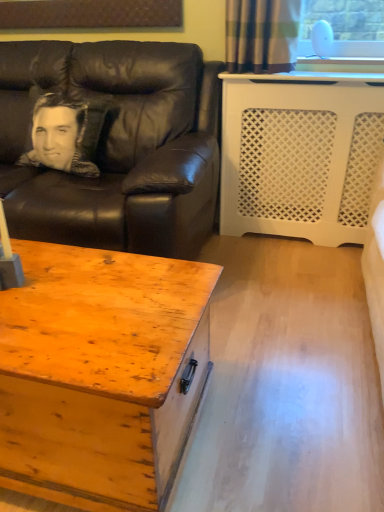
What is the approximate height of black leather couch at left?

37.76 inches.

Identify the location of silky black pillow at left. (59, 135).

Is silky black pillow at left far from black leather couch at left?

silky black pillow at left is actually quite close to black leather couch at left.

Considering the positions of points (60, 106) and (170, 70), is point (60, 106) farther from camera compared to point (170, 70)?

Yes, point (60, 106) is farther from viewer.

From a real-world perspective, which object stands above the other?

silky black pillow at left.

Between silky black pillow at left and black leather couch at left, which one has smaller size?

Smaller between the two is silky black pillow at left.

Is black leather couch at left wider or thinner than silky black pillow at left?

Clearly, black leather couch at left has more width compared to silky black pillow at left.

Is black leather couch at left not inside silky black pillow at left?

Absolutely, black leather couch at left is external to silky black pillow at left.

Is point (186, 92) closer or farther from the camera than point (76, 150)?

Point (186, 92) is farther from the camera than point (76, 150).

Considering the relative sizes of wooden chest at lower left and black leather couch at left in the image provided, is wooden chest at lower left bigger than black leather couch at left?

Actually, wooden chest at lower left might be smaller than black leather couch at left.

Are wooden chest at lower left and black leather couch at left far apart?

That's not correct — wooden chest at lower left is a little close to black leather couch at left.

Is wooden chest at lower left turned away from black leather couch at left?

Correct, wooden chest at lower left is looking away from black leather couch at left.

Identify the location of coffee table that appears on the right of black leather couch at left. This screenshot has width=384, height=512. (99, 372).

Considering the relative sizes of wooden chest at lower left and silky black pillow at left in the image provided, is wooden chest at lower left bigger than silky black pillow at left?

Indeed, wooden chest at lower left has a larger size compared to silky black pillow at left.

Is there a large distance between wooden chest at lower left and silky black pillow at left?

Yes.

Is point (137, 260) farther from viewer compared to point (83, 113)?

That is False.

Is black leather couch at left to the right of wooden chest at lower left from the viewer's perspective?

No, black leather couch at left is not to the right of wooden chest at lower left.

Is black leather couch at left shorter than wooden chest at lower left?

In fact, black leather couch at left may be taller than wooden chest at lower left.

Based on the photo, would you say black leather couch at left is a long distance from wooden chest at lower left?

They are positioned close to each other.

Which object is more forward, black leather couch at left or wooden chest at lower left?

wooden chest at lower left is more forward.

Is silky black pillow at left in contact with wooden chest at lower left?

No, silky black pillow at left is not beside wooden chest at lower left.

Is silky black pillow at left at the left side of wooden chest at lower left?

Indeed, silky black pillow at left is positioned on the left side of wooden chest at lower left.

Consider the image. Is silky black pillow at left aimed at wooden chest at lower left?

No, silky black pillow at left does not turn towards wooden chest at lower left.

Find the location of a particular element. This screenshot has height=512, width=384. man that is on the left side of wooden chest at lower left is located at coordinates (59, 135).

Locate an element on the screen. man behind the black leather couch at left is located at coordinates (59, 135).

What are the coordinates of `studio couch on the right of silky black pillow at left` in the screenshot? It's located at (113, 145).

Based on their spatial positions, is silky black pillow at left or wooden chest at lower left further from black leather couch at left?

wooden chest at lower left is positioned further to the anchor black leather couch at left.

Looking at the image, which one is located closer to black leather couch at left, wooden chest at lower left or silky black pillow at left?

silky black pillow at left is closer to black leather couch at left.

Which object lies further to the anchor point wooden chest at lower left, black leather couch at left or silky black pillow at left?

silky black pillow at left is further to wooden chest at lower left.

From the image, which object appears to be farther from wooden chest at lower left, silky black pillow at left or black leather couch at left?

silky black pillow at left is positioned further to the anchor wooden chest at lower left.

Considering their positions, is wooden chest at lower left positioned further to silky black pillow at left than black leather couch at left?

wooden chest at lower left is positioned further to the anchor silky black pillow at left.

In the scene shown: Based on their spatial positions, is black leather couch at left or wooden chest at lower left closer to silky black pillow at left?

black leather couch at left is positioned closer to the anchor silky black pillow at left.

Locate an element on the screen. This screenshot has width=384, height=512. studio couch between wooden chest at lower left and silky black pillow at left from front to back is located at coordinates (113, 145).